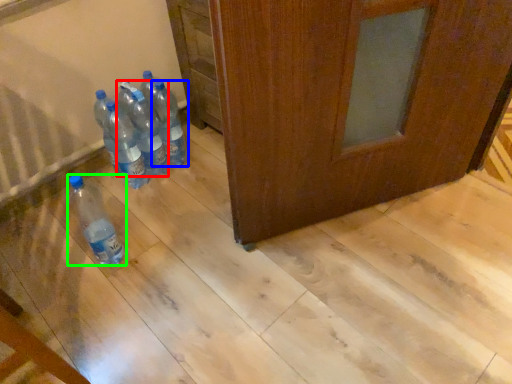
Question: Estimate the real-world distances between objects in this image. Which object is closer to bottle (highlighted by a red box), bottle (highlighted by a blue box) or bottle (highlighted by a green box)?

Choices:
 (A) bottle
 (B) bottle

Answer: (A)